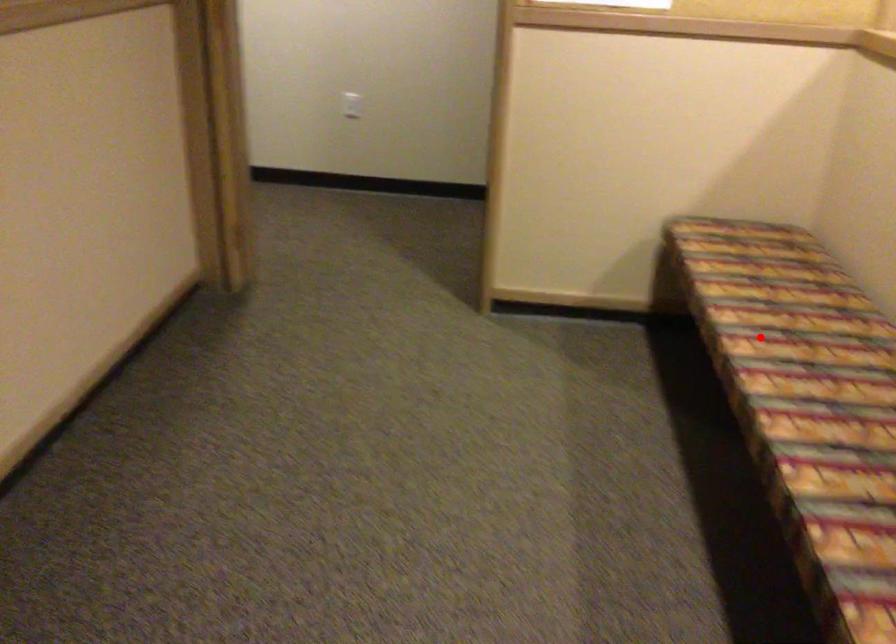
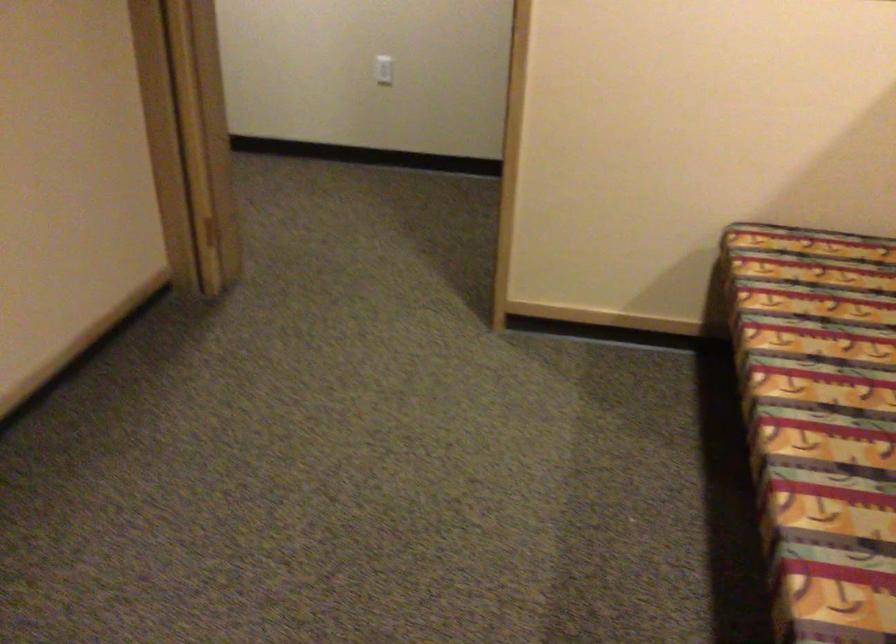
Locate, in the second image, the point that corresponds to the highlighted location in the first image.

(819, 422)